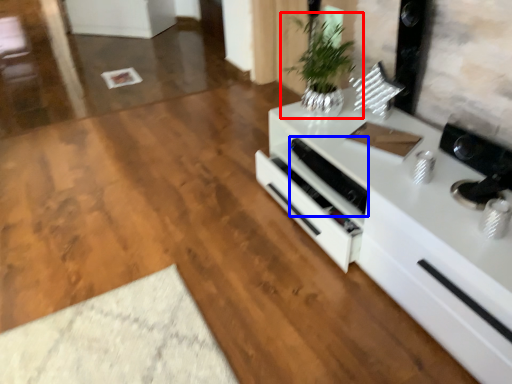
Question: Among these objects, which one is nearest to the camera, houseplant (highlighted by a red box) or appliance (highlighted by a blue box)?

Choices:
 (A) houseplant
 (B) appliance

Answer: (A)